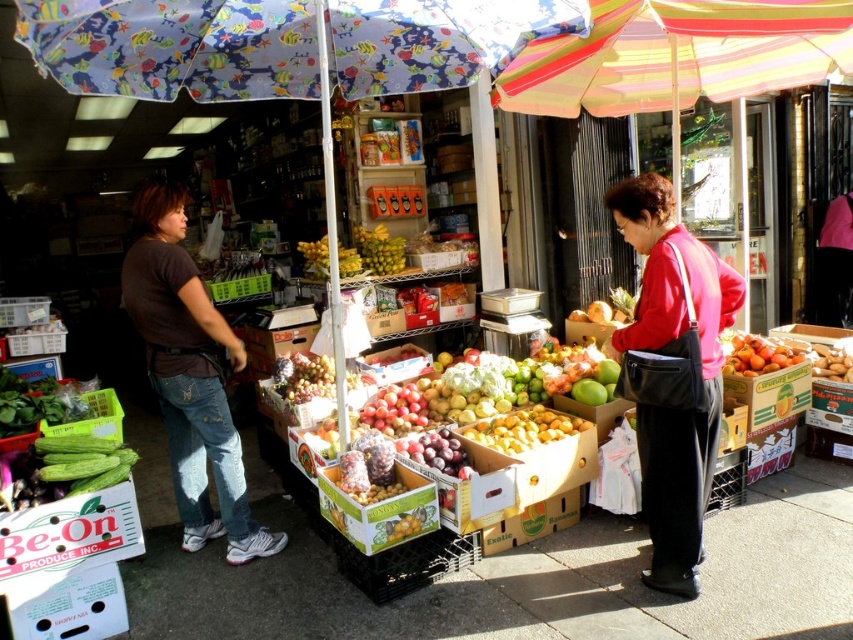
You are a customer at the market and see the brown cotton shirt at left and the shiny purple plums at center. Which item is positioned more to the left?

The brown cotton shirt at left is positioned more to the left than the shiny purple plums at center.

You are a customer at the fruit stand and want to know which fruit is shorter between the shiny purple plums at center and the green matte bananas at center. Can you tell me?

The shiny purple plums at center is not as tall as green matte bananas at center, so the shiny purple plums at center are shorter.

You are a customer at the market and you want to pick up the shiny purple plums at center. However, there is a person wearing a brown cotton shirt at left in the way. Can you reach the plums without moving the person?

The brown cotton shirt at left is located above shiny purple plums at center, so the person is not blocking your path. You can reach the shiny purple plums at center without moving the person.